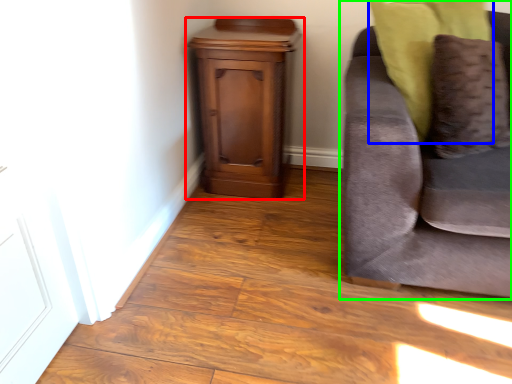
Question: Based on their relative distances, which object is farther from nightstand (highlighted by a red box)? Choose from pillow (highlighted by a blue box) and studio couch (highlighted by a green box).

Choices:
 (A) pillow
 (B) studio couch

Answer: (B)